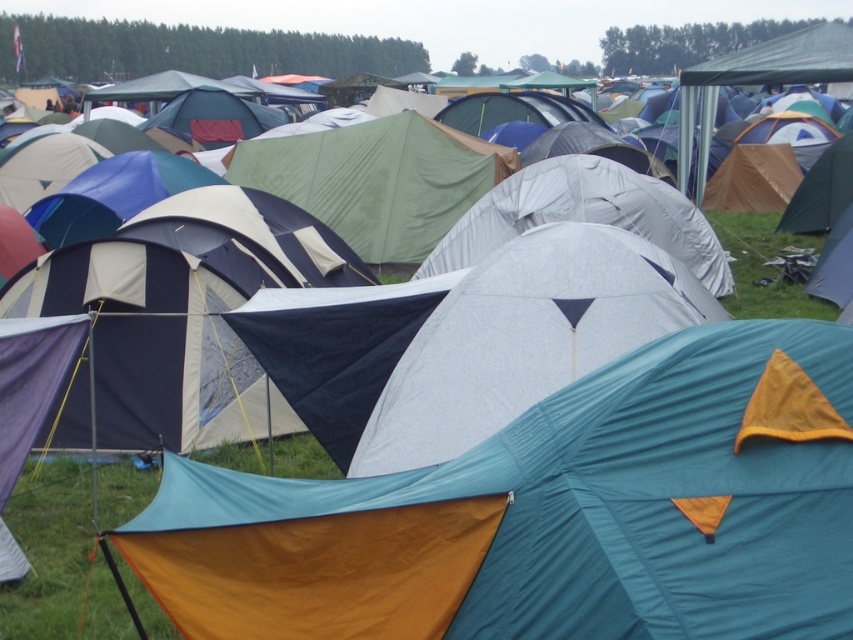
Can you confirm if teal fabric tent at center is positioned below green grass at lower right?

Yes.

Can you confirm if teal fabric tent at center is taller than green grass at lower right?

Yes, teal fabric tent at center is taller than green grass at lower right.

The image size is (853, 640). What do you see at coordinates (550, 515) in the screenshot?
I see `teal fabric tent at center` at bounding box center [550, 515].

In order to click on teal fabric tent at center in this screenshot , I will do `click(550, 515)`.